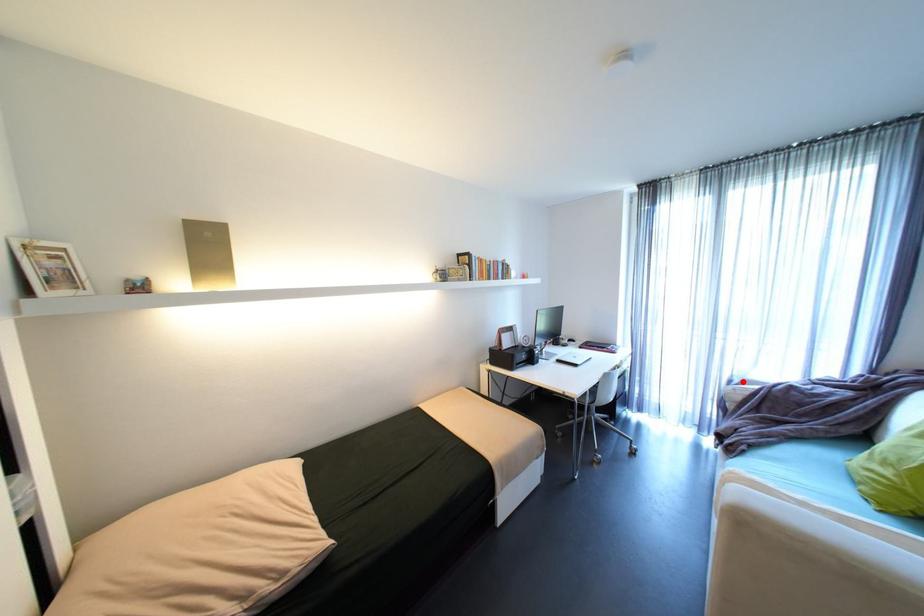
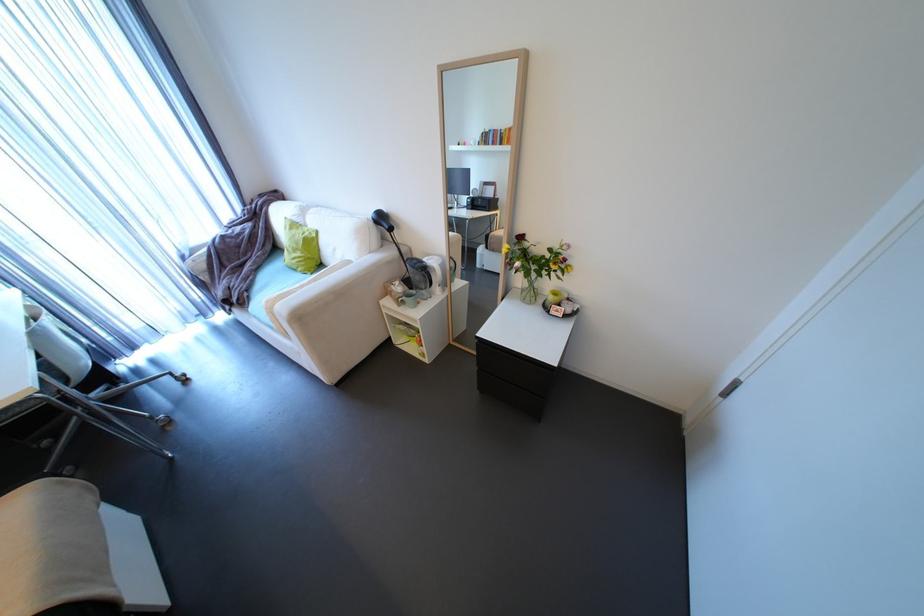
In the second image, find the point that corresponds to the highlighted location in the first image.

(195, 254)